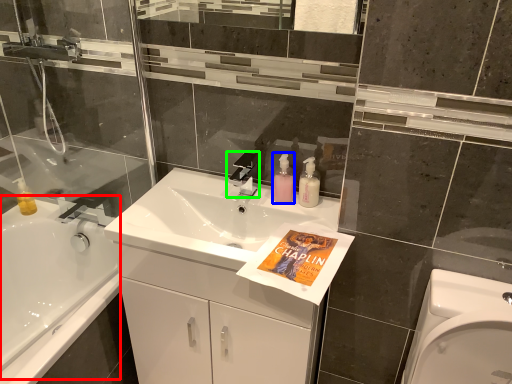
Question: Based on their relative distances, which object is nearer to bath (highlighted by a red box)? Choose from toiletry (highlighted by a blue box) and tap (highlighted by a green box).

Choices:
 (A) toiletry
 (B) tap

Answer: (B)